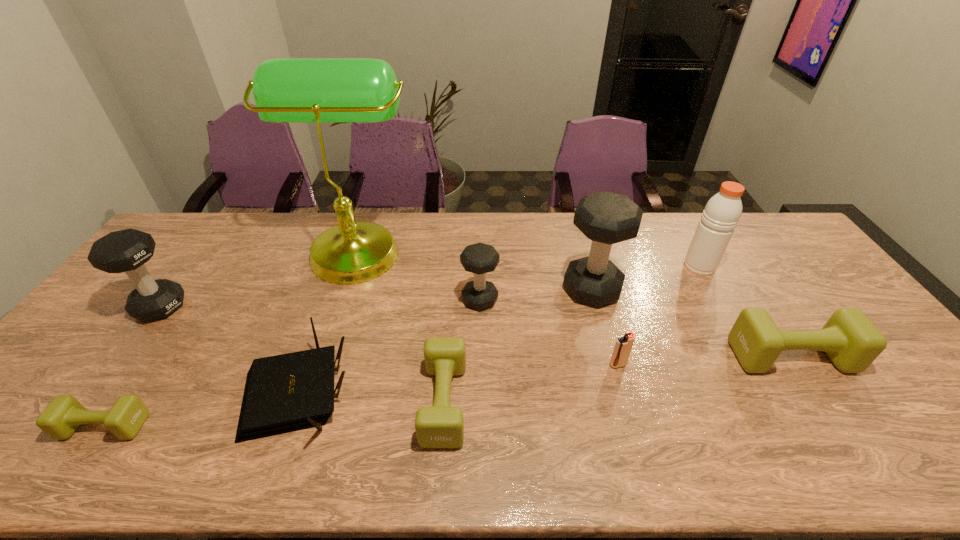
What are the coordinates of `olive dumbbell identified as the second closest to the shaker` in the screenshot? It's located at (441, 425).

The image size is (960, 540). What are the coordinates of `olive dumbbell that is the second nearest to the tallest object` in the screenshot? It's located at (61, 418).

Identify the location of blank area in the image that satisfies the following two spatial constraints: 1. on the desk next to the green lamp; 2. on the left side of the shaker. (351, 266).

Where is `free region that satisfies the following two spatial constraints: 1. on the desk next to the tallest object; 2. on the left side of the second gray dumbbell from right to left`? The width and height of the screenshot is (960, 540). free region that satisfies the following two spatial constraints: 1. on the desk next to the tallest object; 2. on the left side of the second gray dumbbell from right to left is located at coordinates (340, 299).

What are the coordinates of `vacant region that satisfies the following two spatial constraints: 1. on the desk next to the lamp; 2. on the front side of the fourth tallest object` in the screenshot? It's located at (338, 307).

This screenshot has height=540, width=960. I want to click on free spot that satisfies the following two spatial constraints: 1. on the desk next to the tallest object; 2. on the right side of the orange shaker, so click(x=351, y=266).